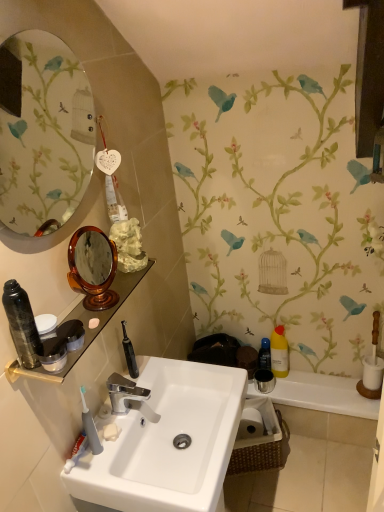
Question: Is transparent plastic bottle at lower right, arranged as the third toiletry when viewed from the left, facing towards yellow translucent bottle at right, arranged as the second toiletry when viewed from the back?

Choices:
 (A) no
 (B) yes

Answer: (A)

Question: Can you confirm if transparent plastic bottle at lower right, the 2th toiletry when ordered from right to left, is bigger than yellow translucent bottle at right, arranged as the second toiletry when viewed from the back?

Choices:
 (A) no
 (B) yes

Answer: (A)

Question: Could yellow translucent bottle at right, acting as the 3th toiletry starting from the front, be considered to be inside transparent plastic bottle at lower right, arranged as the third toiletry when viewed from the left?

Choices:
 (A) yes
 (B) no

Answer: (B)

Question: Is transparent plastic bottle at lower right, the 2th toiletry when ordered from right to left, smaller than yellow translucent bottle at right, acting as the 3th toiletry starting from the front?

Choices:
 (A) yes
 (B) no

Answer: (A)

Question: Is transparent plastic bottle at lower right, the fourth toiletry when ordered from front to back, facing away from yellow translucent bottle at right, arranged as the second toiletry when viewed from the back?

Choices:
 (A) no
 (B) yes

Answer: (A)

Question: From a real-world perspective, is shiny black canister at left, which appears as the 1th toiletry when viewed from the left, above or below white glossy sink at center?

Choices:
 (A) above
 (B) below

Answer: (A)

Question: From their relative heights in the image, would you say shiny black canister at left, which is the 1th toiletry from front to back, is taller or shorter than white glossy sink at center?

Choices:
 (A) tall
 (B) short

Answer: (B)

Question: Considering the positions of point (23, 362) and point (233, 378), is point (23, 362) closer or farther from the camera than point (233, 378)?

Choices:
 (A) farther
 (B) closer

Answer: (B)

Question: Is shiny black canister at left, placed as the 4th toiletry when sorted from right to left, in front of or behind white glossy sink at center in the image?

Choices:
 (A) front
 (B) behind

Answer: (A)

Question: Is oval glass mirror at upper left taller or shorter than white glossy sink at center?

Choices:
 (A) short
 (B) tall

Answer: (A)

Question: From the image's perspective, is oval glass mirror at upper left positioned above or below white glossy sink at center?

Choices:
 (A) below
 (B) above

Answer: (B)

Question: Is oval glass mirror at upper left bigger or smaller than white glossy sink at center?

Choices:
 (A) big
 (B) small

Answer: (B)

Question: In the image, is oval glass mirror at upper left positioned in front of or behind white glossy sink at center?

Choices:
 (A) front
 (B) behind

Answer: (A)

Question: Considering the positions of point (276, 350) and point (309, 392), is point (276, 350) closer or farther from the camera than point (309, 392)?

Choices:
 (A) closer
 (B) farther

Answer: (B)

Question: From a real-world perspective, is yellow translucent bottle at right, the 4th toiletry when ordered from left to right, positioned above or below metallic silver cup at right?

Choices:
 (A) above
 (B) below

Answer: (A)